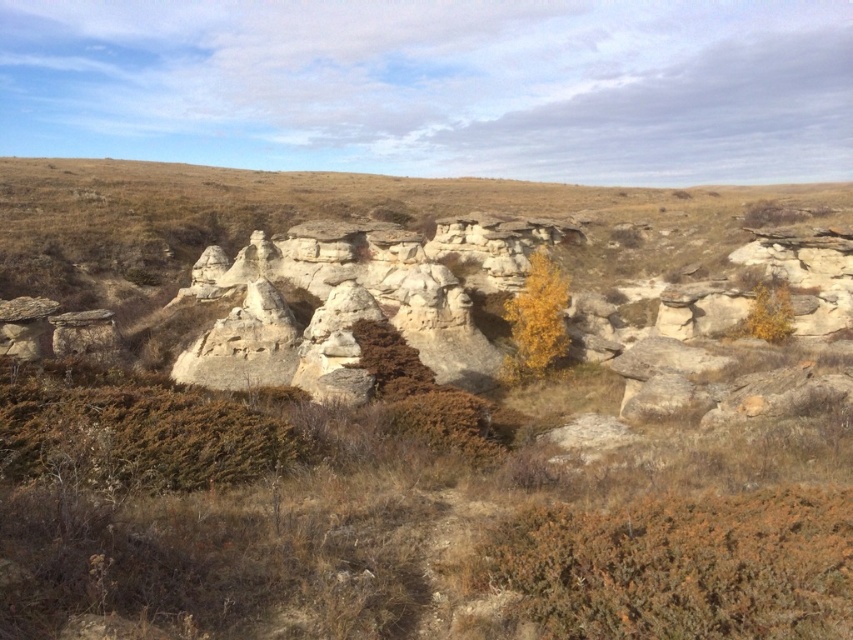
You are standing in the rugged landscape and want to take a photo of both the white sandstone rock formation at center and the yellow leafy tree at center. Which object should you position to the left side of your camera frame to include both in the shot?

The white sandstone rock formation at center is already positioned to the left of the yellow leafy tree at center. To include both in your photo, position the white sandstone rock formation at center on the left side of the camera frame and the yellow leafy tree at center on the right side.

Looking at this image, you are standing at the base of the eroded rock formations in the rugged landscape. You notice two points marked in the scene. The first point is at coordinates point (223, 273) and the second is at point (759, 323). Which point is closer to your current position?

Point (223, 273) is further to the camera than point (759, 323). Therefore, the point closer to your current position is point (759, 323).